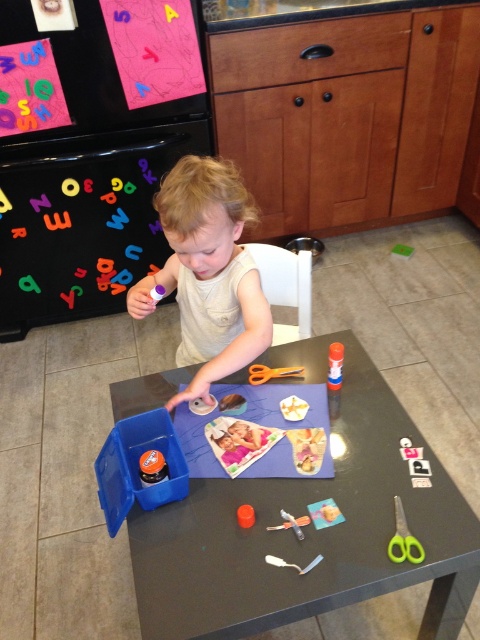
Question: Is smooth beige shirt at center further to the viewer compared to metallic silver scissors at center?

Choices:
 (A) no
 (B) yes

Answer: (B)

Question: Which object appears farthest from the camera in this image?

Choices:
 (A) matte plastic table at center
 (B) orange plastic scissors at table
 (C) green plastic scissors at lower right
 (D) metallic silver scissors at center

Answer: (B)

Question: Is metallic silver scissors at center thinner than white plastic spoon at center?

Choices:
 (A) yes
 (B) no

Answer: (A)

Question: Which object is farther from the camera taking this photo?

Choices:
 (A) white plastic spoon at center
 (B) metallic silver scissors at center
 (C) matte plastic table at center
 (D) smooth beige shirt at center

Answer: (D)

Question: Which object is positioned farthest from the metallic silver scissors at center?

Choices:
 (A) white plastic spoon at center
 (B) matte plastic table at center
 (C) green plastic scissors at lower right

Answer: (B)

Question: Can you confirm if matte plastic table at center is positioned to the right of smooth beige shirt at center?

Choices:
 (A) yes
 (B) no

Answer: (A)